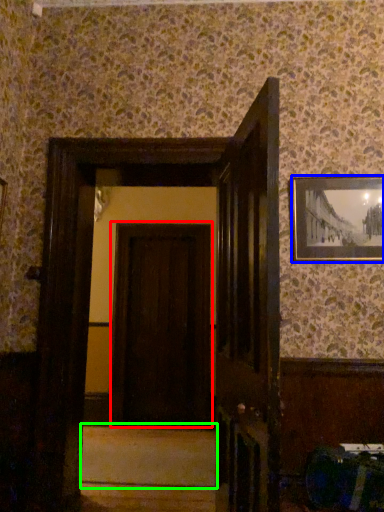
Question: Based on their relative distances, which object is nearer to door (highlighted by a red box)? Choose from picture frame (highlighted by a blue box) and stair (highlighted by a green box).

Choices:
 (A) picture frame
 (B) stair

Answer: (B)